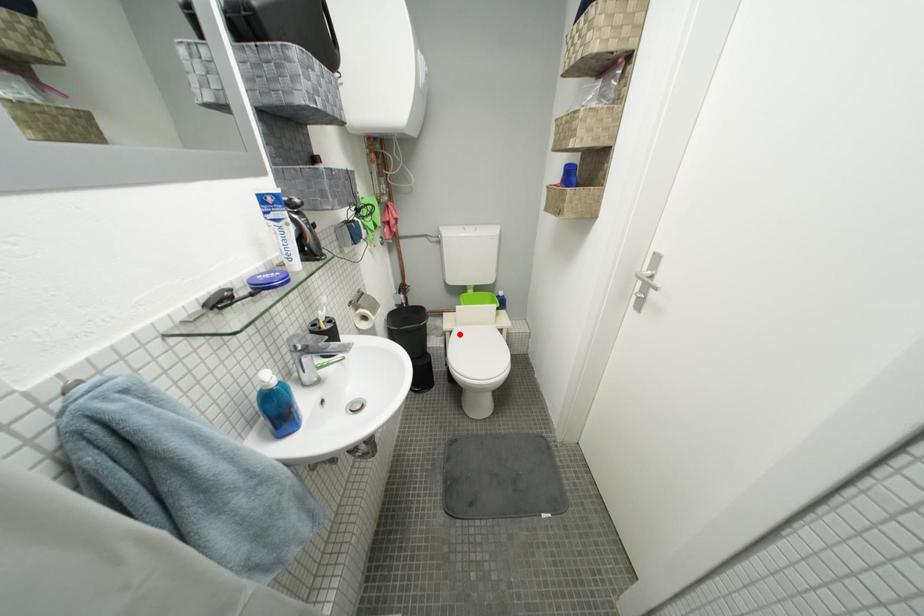
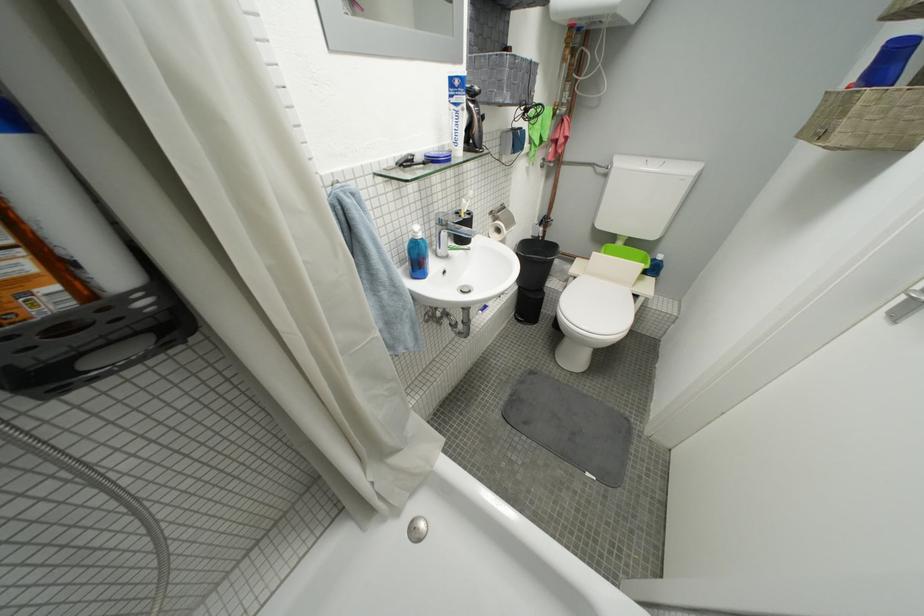
Question: I am providing you with two images of the same scene from different viewpoints. Image1 has a red point marked. In image2, the corresponding 3D location appears at what relative position? Reply with the corresponding letter.

Choices:
 (A) Closer
 (B) Farther

Answer: (A)